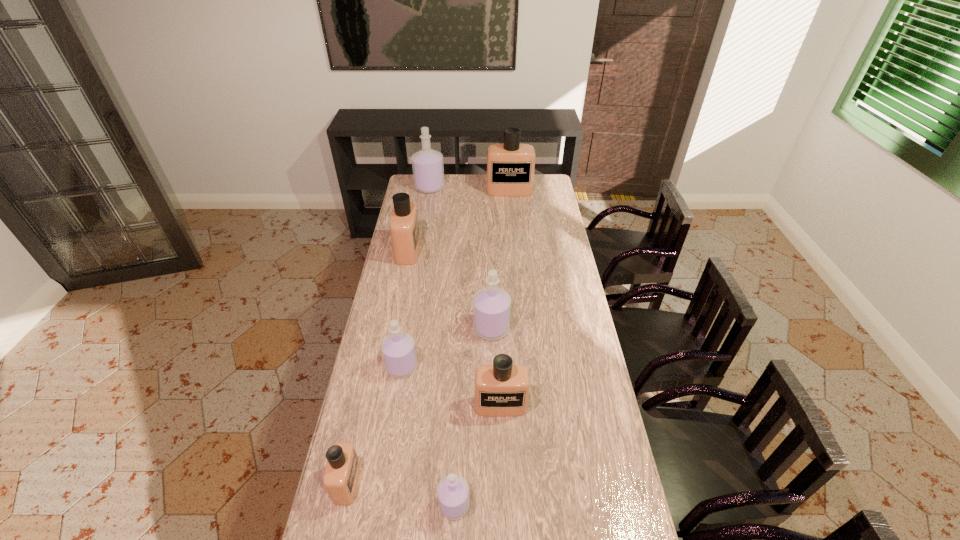
Where is `vacant space located 0.290m on the right of the fourth object from right to left`? The image size is (960, 540). vacant space located 0.290m on the right of the fourth object from right to left is located at coordinates (571, 505).

This screenshot has height=540, width=960. I want to click on object at the right edge, so click(510, 166).

Where is `object located in the far left corner section of the desktop`? object located in the far left corner section of the desktop is located at coordinates (427, 164).

You are a GUI agent. You are given a task and a screenshot of the screen. Output one action in this format:
    pyautogui.click(x=<x>, y=<y>)
    Task: Click on the object situated at the far right corner
    
    Given the screenshot: What is the action you would take?
    pyautogui.click(x=510, y=166)

At what (x,y) coordinates should I click in order to perform the action: click on free space at the far edge. Please return your answer as a coordinate pair (x, y). The image size is (960, 540). Looking at the image, I should click on (452, 195).

This screenshot has width=960, height=540. What are the coordinates of `free space at the left edge` in the screenshot? It's located at (384, 421).

Where is `free space at the right edge`? Image resolution: width=960 pixels, height=540 pixels. free space at the right edge is located at coordinates (555, 371).

You are a GUI agent. You are given a task and a screenshot of the screen. Output one action in this format:
    pyautogui.click(x=<x>, y=<y>)
    Task: Click on the free spot between the third smallest purple perfume and the smallest beige perfume
    
    Given the screenshot: What is the action you would take?
    pyautogui.click(x=420, y=406)

In order to click on free space between the fifth perfume from left to right and the third smallest beige perfume in this screenshot , I will do `click(431, 378)`.

You are a GUI agent. You are given a task and a screenshot of the screen. Output one action in this format:
    pyautogui.click(x=<x>, y=<y>)
    Task: Click on the free point between the farthest purple perfume and the fourth farthest perfume
    This screenshot has width=960, height=540.
    Given the screenshot: What is the action you would take?
    pyautogui.click(x=461, y=258)